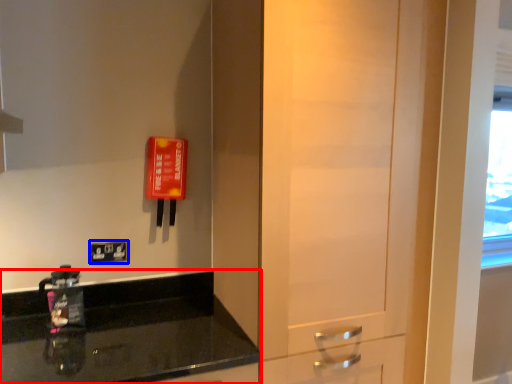
Question: Which object is closer to the camera taking this photo, countertop (highlighted by a red box) or light switch (highlighted by a blue box)?

Choices:
 (A) countertop
 (B) light switch

Answer: (A)